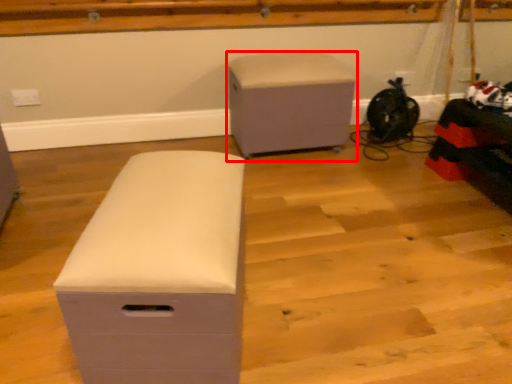
Question: Considering the relative positions of furniture (annotated by the red box) and furniture in the image provided, where is furniture (annotated by the red box) located with respect to the staircase?

Choices:
 (A) right
 (B) left

Answer: (A)